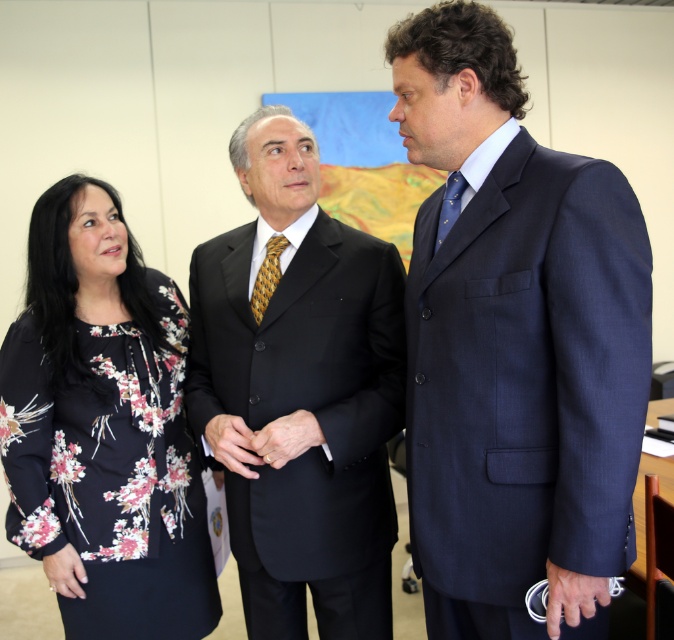
You are an event planner organizing a meeting in an office. You need to ensure that the navy blue suit at center and the blue silk tie at right are visible to all attendees. Based on their positions, which one is lower and might need to be adjusted for better visibility?

The navy blue suit at center is positioned under the blue silk tie at right, so it is lower and might need to be adjusted for better visibility.

You are an interior designer assessing the office layout. You need to place a floor lamp between the matte black suit at center and the blue silk tie at right. Which side of the lamp should face the taller object?

The matte black suit at center is taller than the blue silk tie at right, so the floor lamp should be placed with its light facing the taller object, which is the matte black suit at center.

You are an interior designer assessing the office layout. You need to place a decorative shelf between the matte black suit at center and the blue silk tie at right. Based on their positions, which object should the shelf be closer to?

Since the matte black suit at center might be wider than the blue silk tie at right, the shelf should be placed closer to the blue silk tie at right to maintain balance in the office layout.